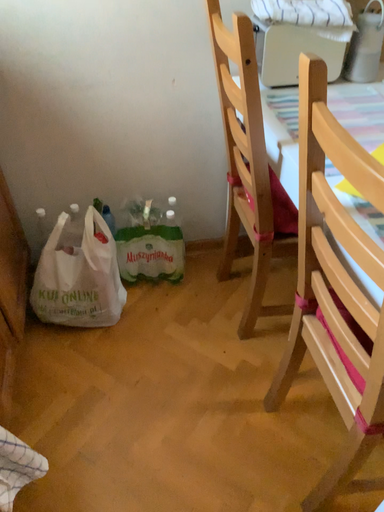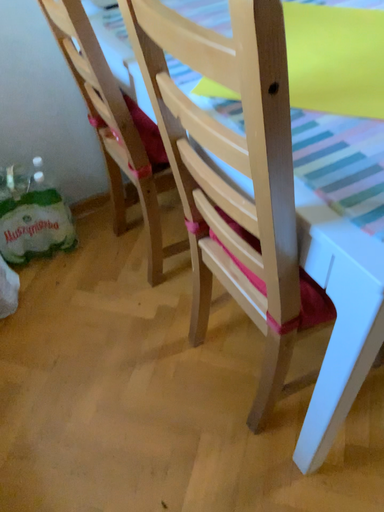
Question: How did the camera likely rotate when shooting the video?

Choices:
 (A) rotated left
 (B) rotated right

Answer: (B)